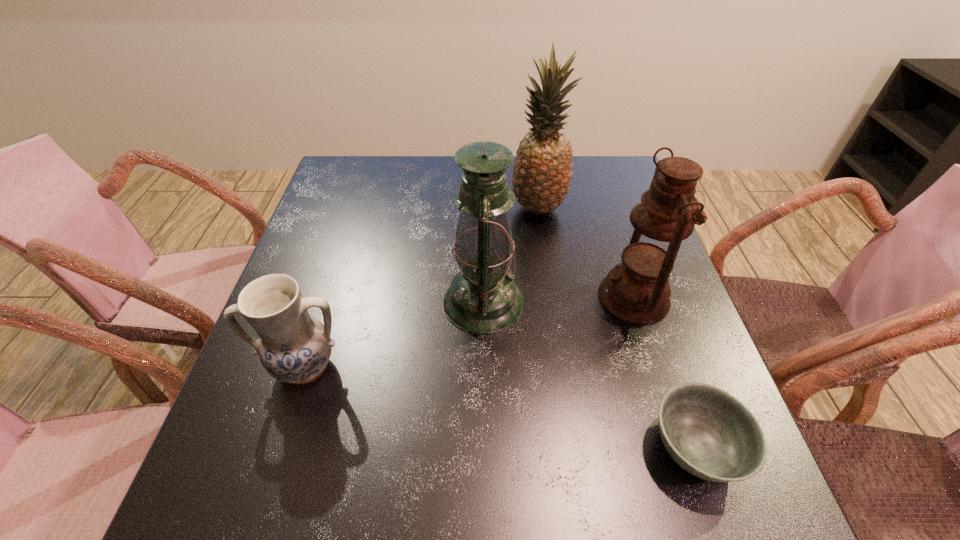
This screenshot has width=960, height=540. I want to click on unoccupied area between the leftmost object and the left oil lamp, so click(x=395, y=334).

Find the location of a particular element. the fourth closest object to the farthest object is located at coordinates (708, 432).

Find the location of `object that ranks as the closest to the farthest object`. object that ranks as the closest to the farthest object is located at coordinates (637, 290).